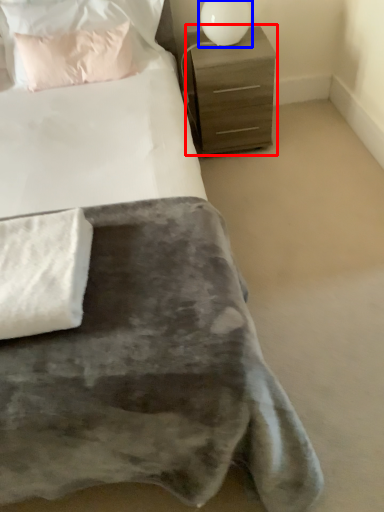
Question: Which of the following is the closest to the observer, chest of drawers (highlighted by a red box) or table lamp (highlighted by a blue box)?

Choices:
 (A) chest of drawers
 (B) table lamp

Answer: (B)